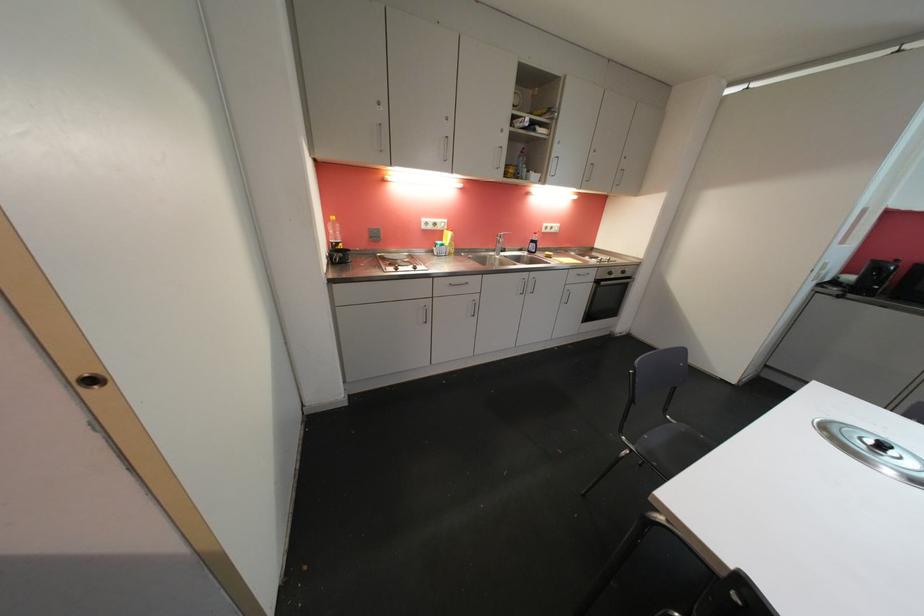
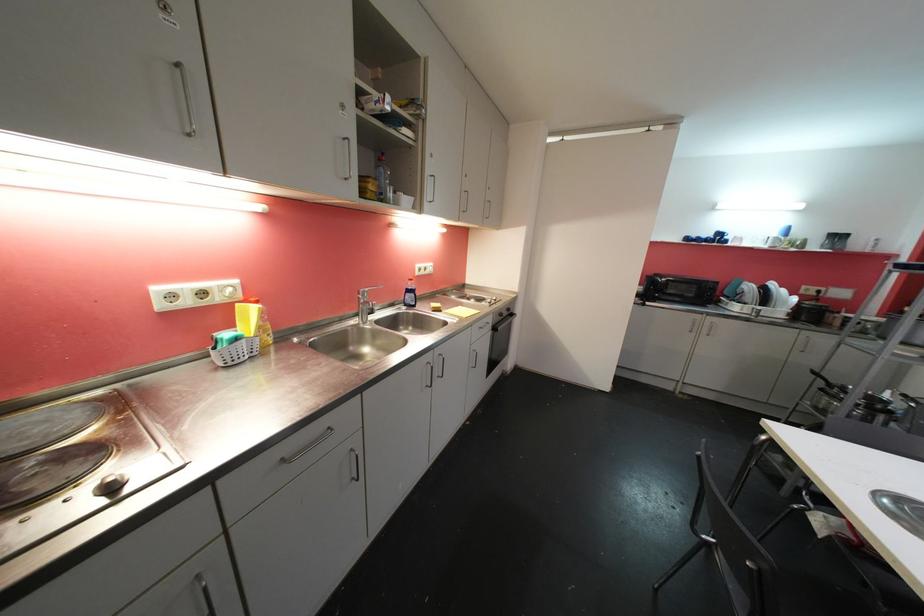
The point at (x=558, y=156) is marked in the first image. Where is the corresponding point in the second image?

(432, 174)